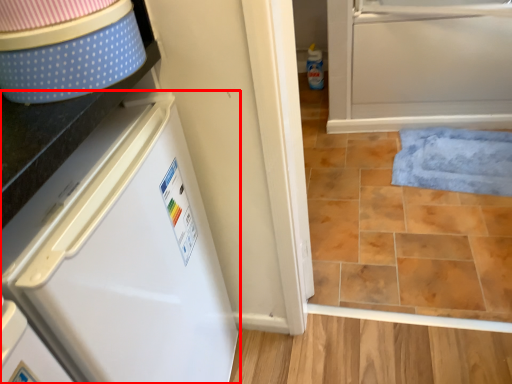
Question: From the image's perspective, where is refrigerator (annotated by the red box) located in relation to bath mat in the image?

Choices:
 (A) below
 (B) above

Answer: (A)